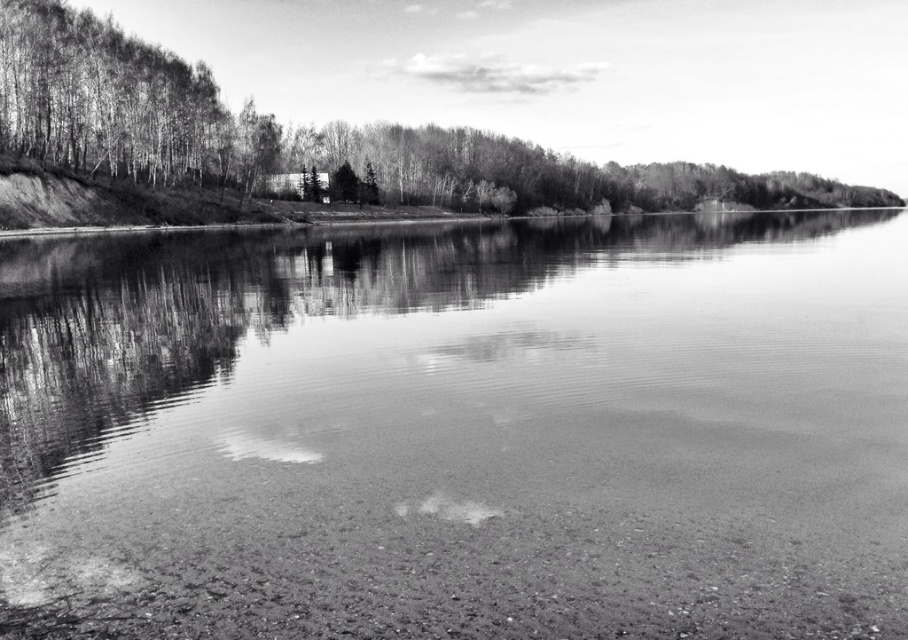
You are standing on the lakeside and see the smooth water at center and the smooth bark tree at upper left. Which object is closer to your right side?

The smooth bark tree at upper left is to the right of the smooth water at center, so the smooth bark tree at upper left is closer to your right side.

You are standing at the lakeside and want to take a photo of both the smooth water at center and the smooth bark tree at upper left. Which object should you focus on first if you want both to be in sharp focus?

You should focus on the smooth bark tree at upper left first because it is farther away from the viewer than the smooth water at center. By focusing on the farther object, the closer object will also be in focus due to the depth of field.

In the scene shown: You are standing at the lakeside and want to take a photo of the smooth water at center and the smooth bark tree at upper left. Which object is closer to the camera?

The smooth water at center is closer to the camera because it is shorter than the smooth bark tree at upper left, meaning it appears lower in the frame.